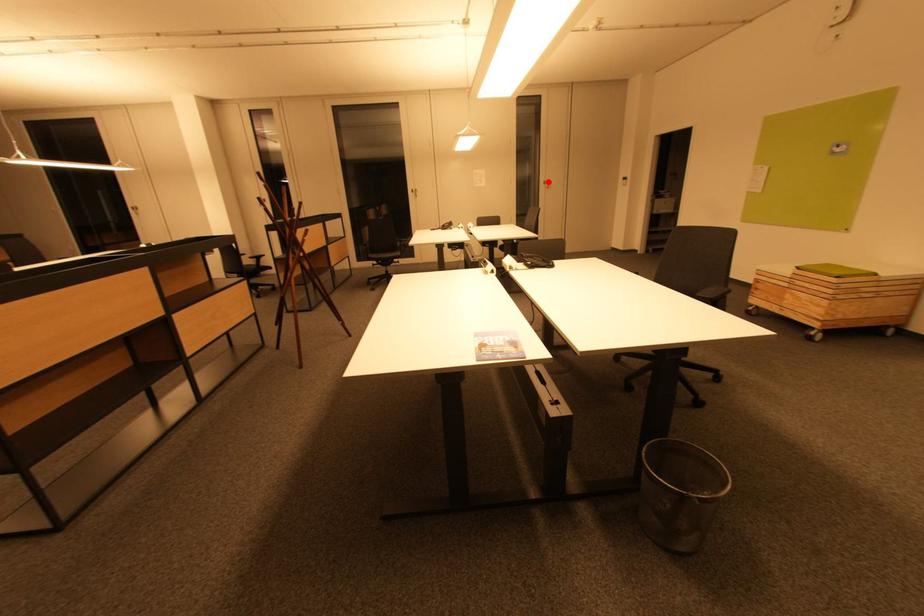
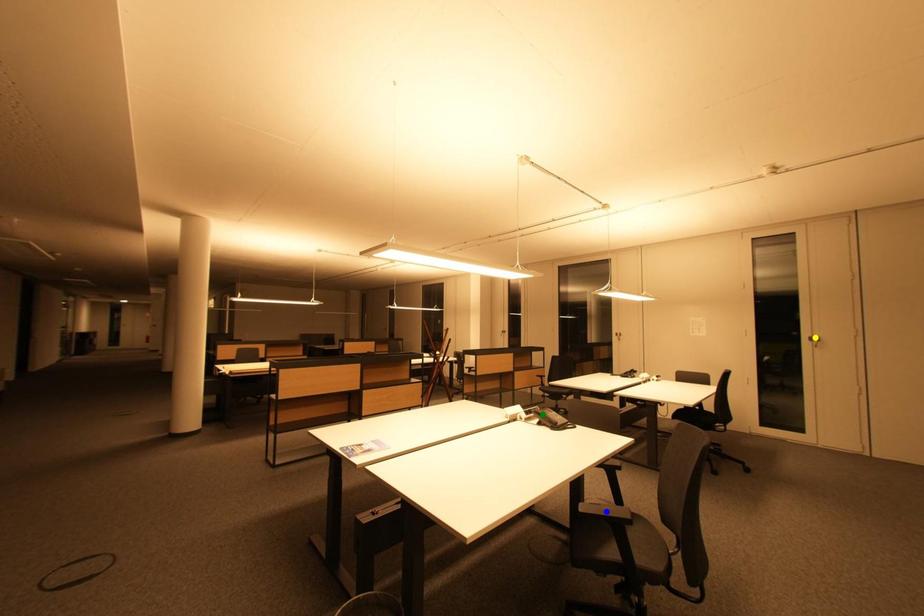
Question: I am providing you with two images of the same scene from different viewpoints. A red point is marked on the first image. You are given multiple points on the second image. Which point in image 2 is actually the same real-world point as the red point in image 1?

Choices:
 (A) green point
 (B) yellow point
 (C) blue point

Answer: (B)